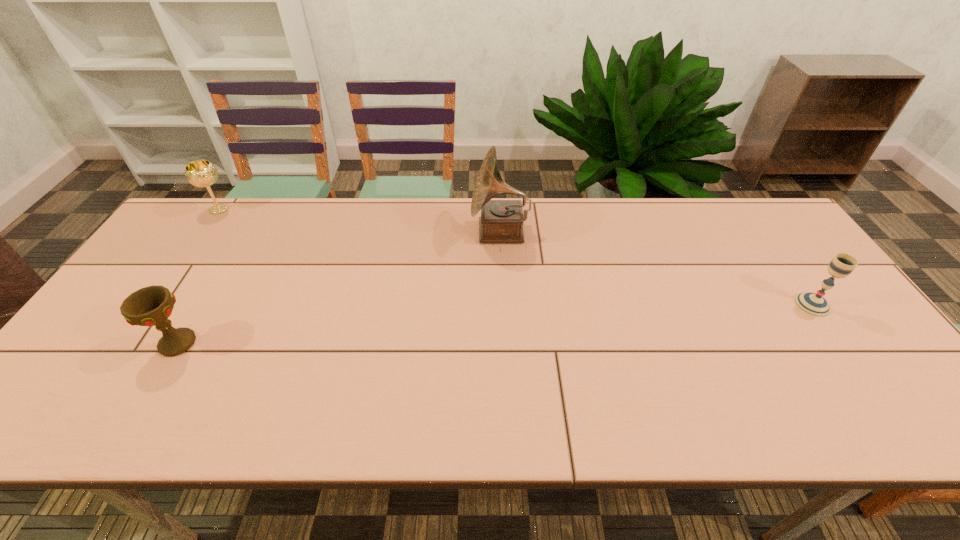
You are a GUI agent. You are given a task and a screenshot of the screen. Output one action in this format:
    pyautogui.click(x=<x>, y=<y>)
    Task: Click on the free space that satisfies the following two spatial constraints: 1. on the horn of the phonograph record; 2. on the left side of the second farthest chalice
    This screenshot has height=540, width=960.
    Given the screenshot: What is the action you would take?
    pyautogui.click(x=504, y=305)

Locate an element on the screen. Image resolution: width=960 pixels, height=540 pixels. free space that satisfies the following two spatial constraints: 1. on the horn of the phonograph record; 2. on the right side of the second nearest chalice is located at coordinates (504, 305).